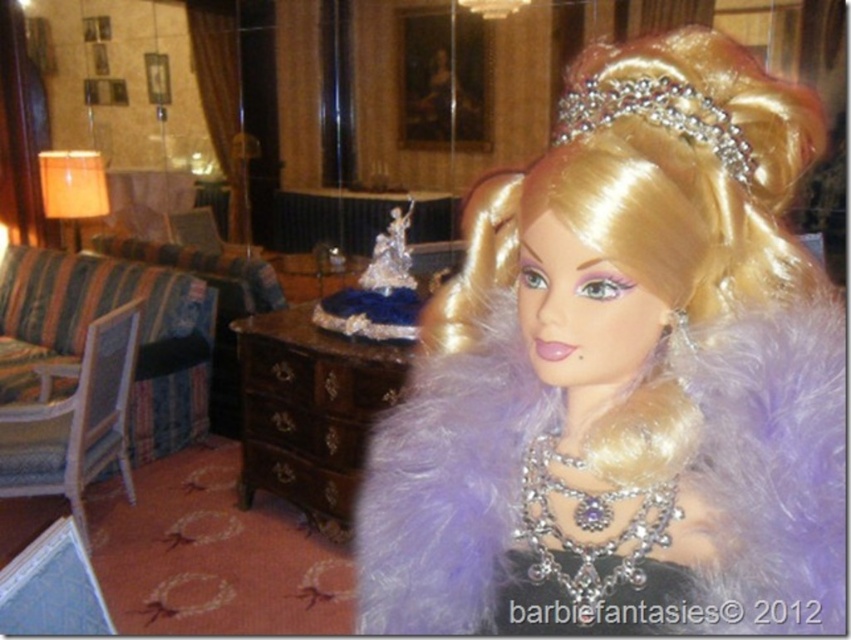
Which is below, silky blonde wig at upper center or diamond encrusted tiara at upper center?

silky blonde wig at upper center is lower down.

Who is taller, silky blonde wig at upper center or diamond encrusted tiara at upper center?

Standing taller between the two is silky blonde wig at upper center.

You are a GUI agent. You are given a task and a screenshot of the screen. Output one action in this format:
    pyautogui.click(x=<x>, y=<y>)
    Task: Click on the silky blonde wig at upper center
    Image resolution: width=851 pixels, height=640 pixels.
    Given the screenshot: What is the action you would take?
    625,378

Is the position of silky blonde wig at upper center less distant than that of white wood armchair at left?

Yes, it is.

Describe the element at coordinates (625, 378) in the screenshot. This screenshot has width=851, height=640. I see `silky blonde wig at upper center` at that location.

Does point (564, 276) come behind point (83, 536)?

No, (564, 276) is in front of (83, 536).

This screenshot has height=640, width=851. I want to click on silky blonde wig at upper center, so click(x=625, y=378).

Which is in front, point (100, 364) or point (647, 84)?

Point (647, 84) is more forward.

In the scene shown: Who is positioned more to the right, white wood armchair at left or diamond encrusted tiara at upper center?

Positioned to the right is diamond encrusted tiara at upper center.

Describe the element at coordinates (73, 420) in the screenshot. I see `white wood armchair at left` at that location.

In order to click on white wood armchair at left in this screenshot , I will do `click(73, 420)`.